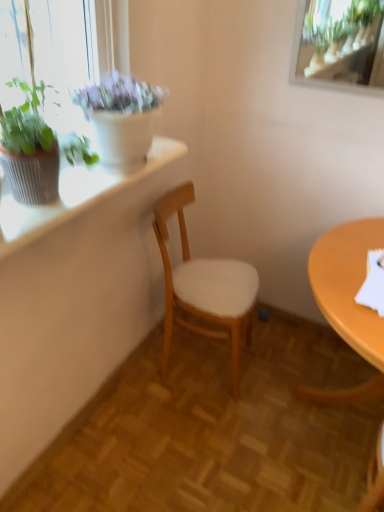
This screenshot has height=512, width=384. Find the location of `free point below white woven wood chair at center (from a real-world perspective)`. free point below white woven wood chair at center (from a real-world perspective) is located at coordinates (196, 360).